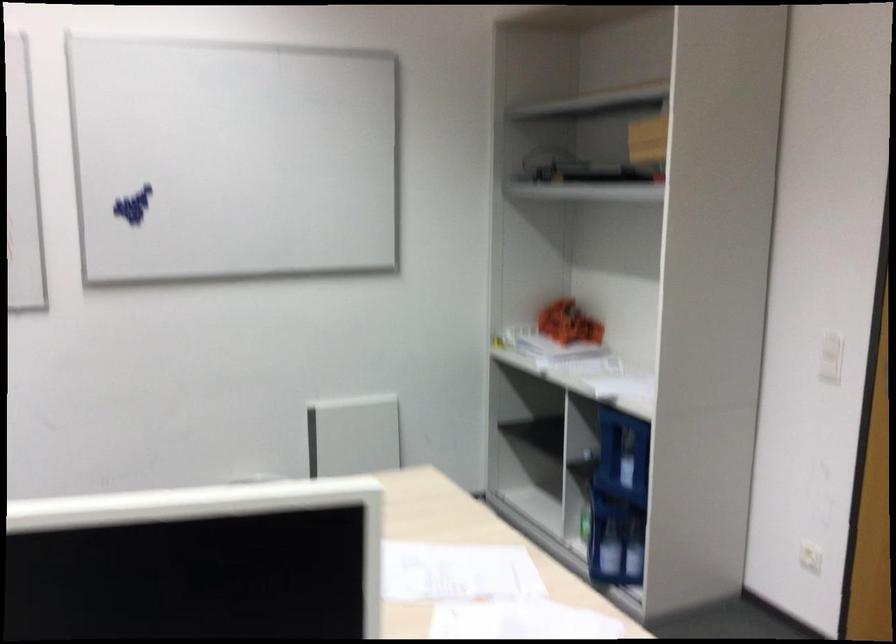
Locate an element on the screen. light switch is located at coordinates (830, 357).